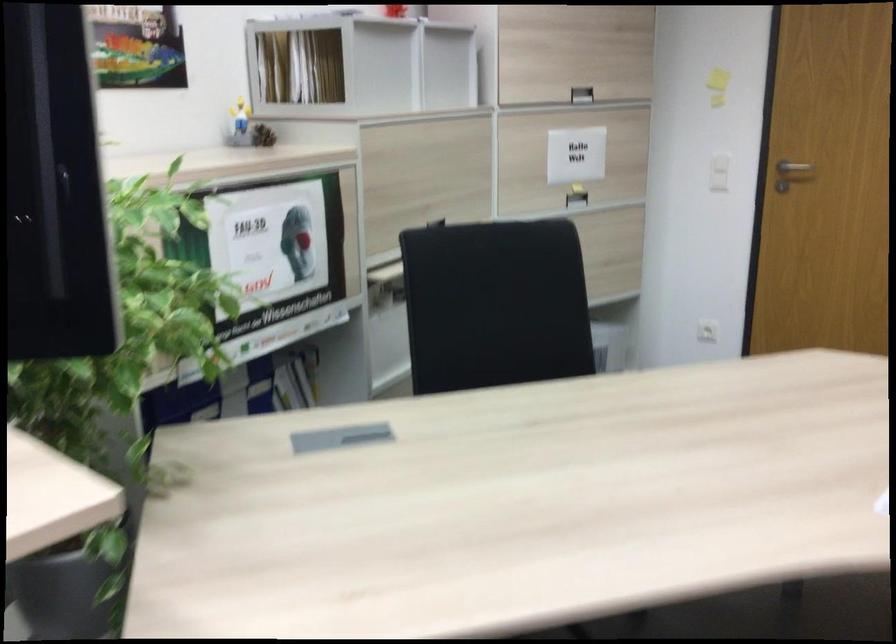
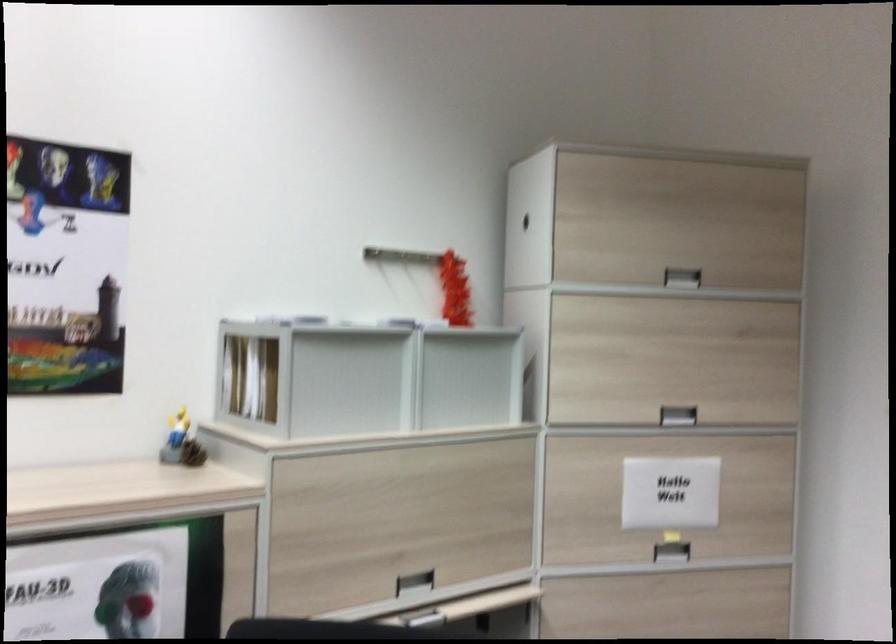
The point at (264, 136) is marked in the first image. Where is the corresponding point in the second image?

(192, 453)